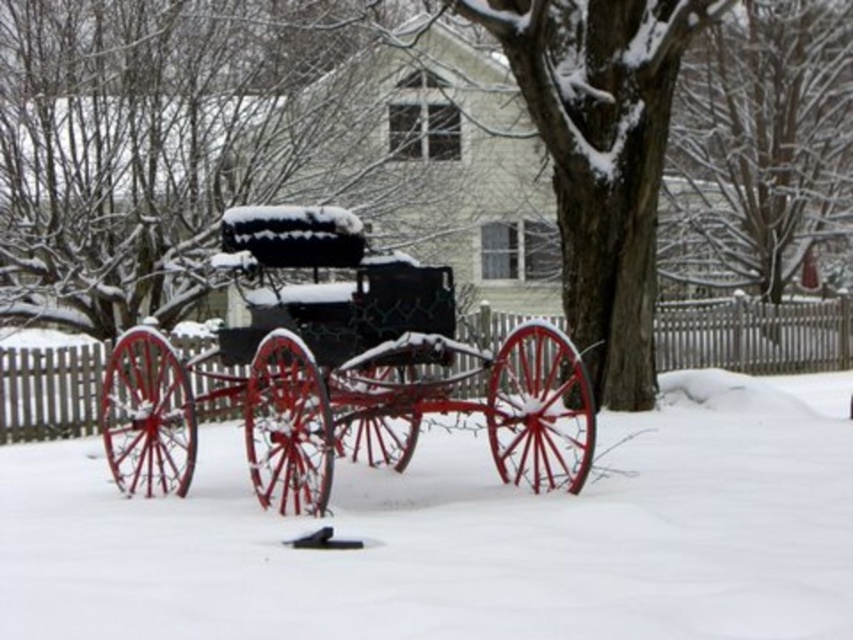
Which of these two, white powdery snow at center or metallic black carriage at center, stands shorter?

white powdery snow at center

Between white powdery snow at center and metallic black carriage at center, which one has more height?

With more height is metallic black carriage at center.

Find the location of a particular element. white powdery snow at center is located at coordinates (463, 534).